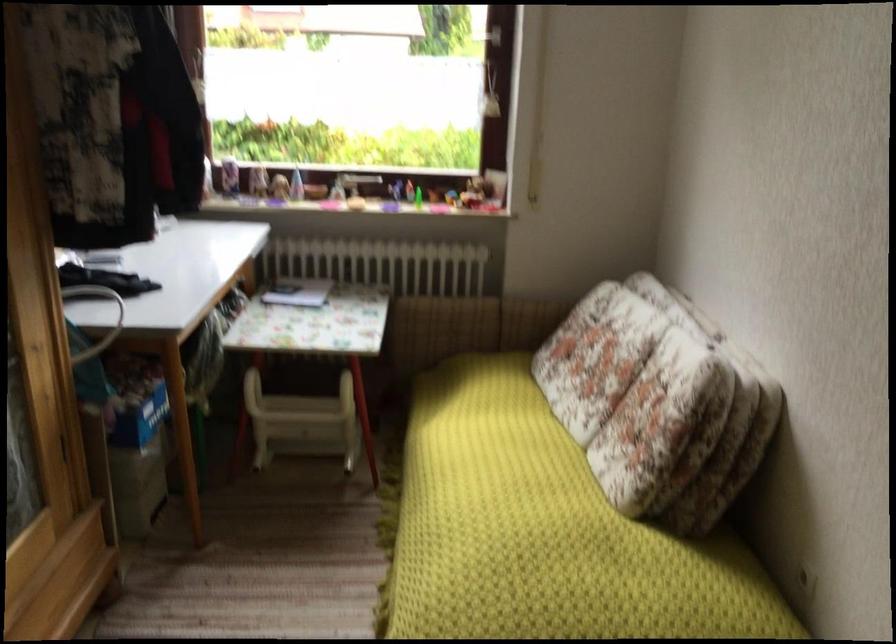
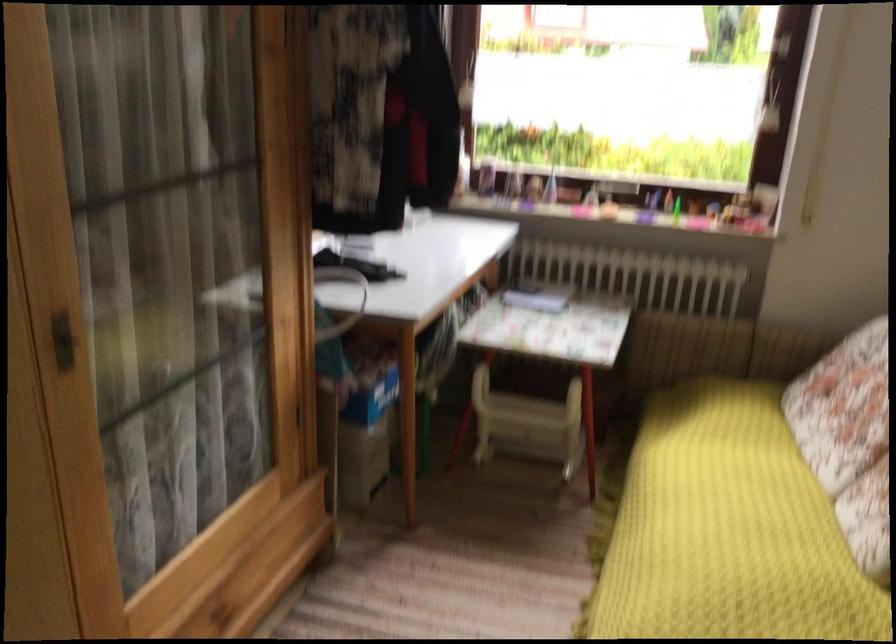
Where in the second image is the point corresponding to [497,486] from the first image?

(728, 529)